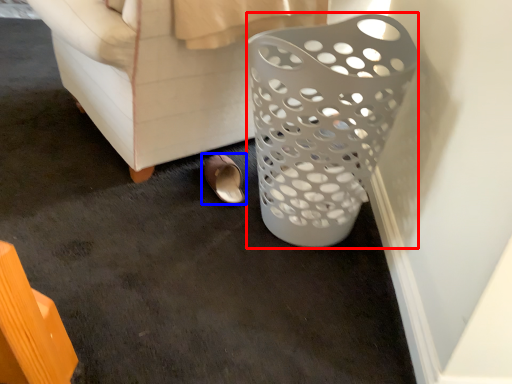
Question: Which point is further to the camera, basket (highlighted by a red box) or footwear (highlighted by a blue box)?

Choices:
 (A) basket
 (B) footwear

Answer: (B)